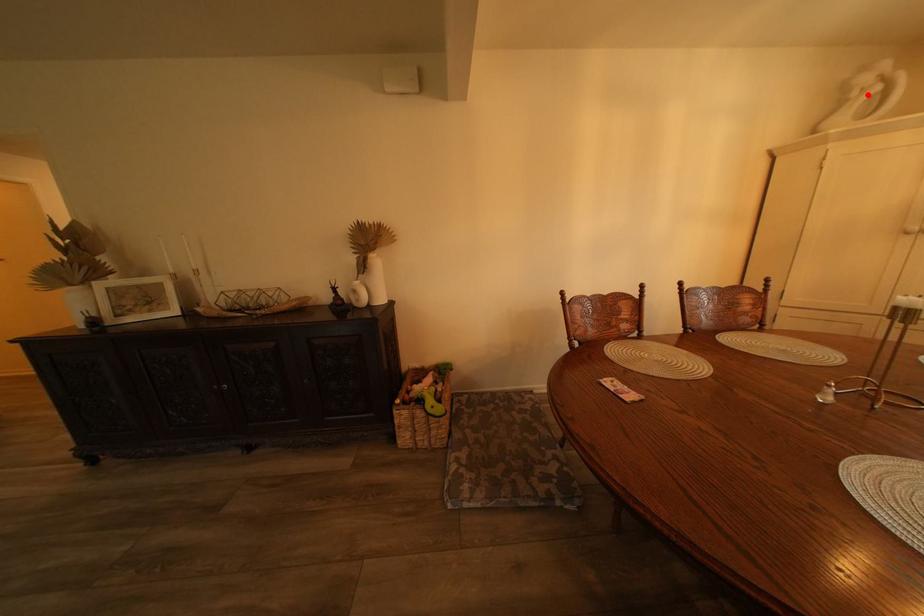
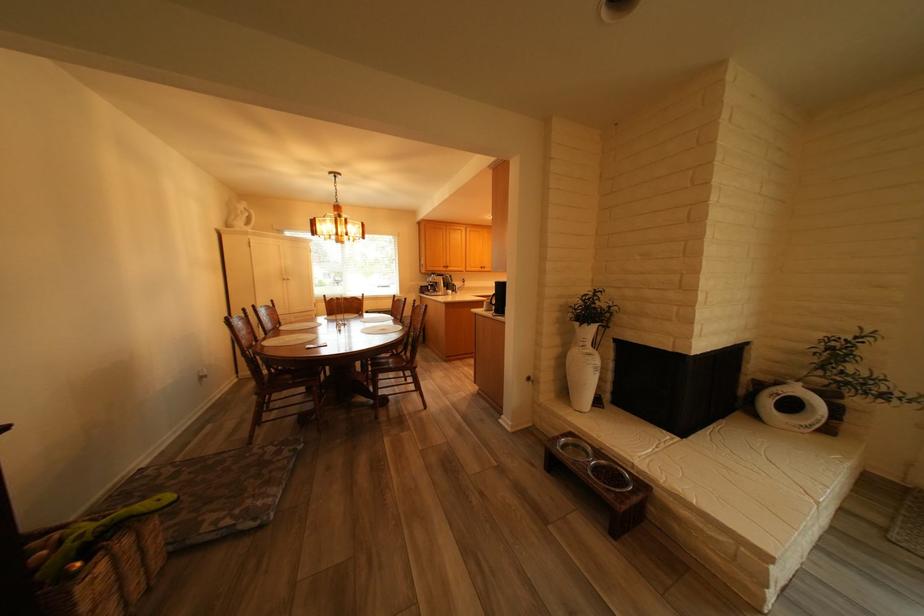
The point at the highlighted location is marked in the first image. Where is the corresponding point in the second image?

(253, 213)